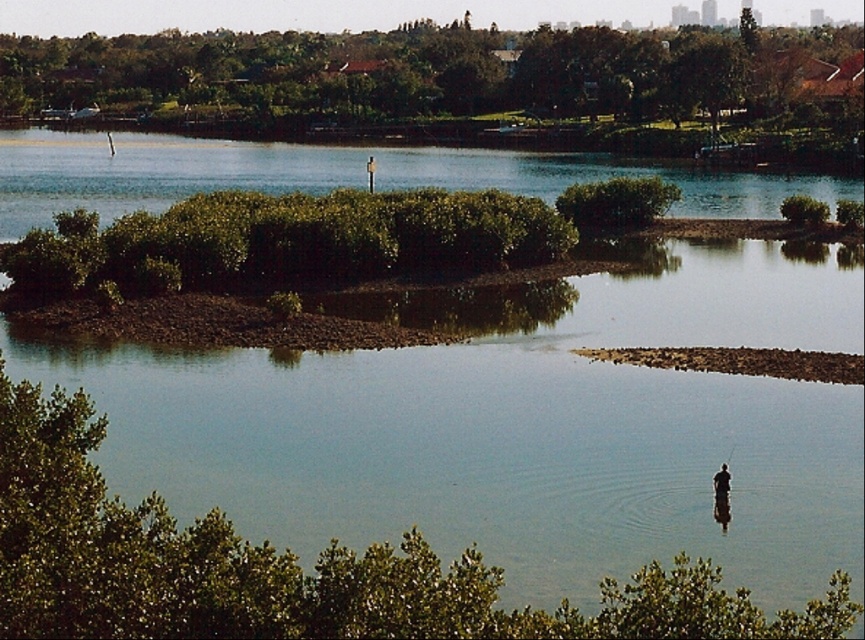
Can you confirm if green leafy tree at lower center is smaller than dark brown wooden pole at center?

Incorrect, green leafy tree at lower center is not smaller in size than dark brown wooden pole at center.

Is green leafy tree at lower center below dark brown wooden pole at center?

Actually, green leafy tree at lower center is above dark brown wooden pole at center.

Describe the element at coordinates (290, 566) in the screenshot. I see `green leafy tree at lower center` at that location.

The height and width of the screenshot is (640, 865). In order to click on green leafy tree at lower center in this screenshot , I will do `click(290, 566)`.

Which is in front, point (648, 116) or point (718, 470)?

Point (718, 470) is more forward.

Is point (286, 104) positioned in front of point (723, 484)?

No, (286, 104) is behind (723, 484).

Locate an element on the screen. green leafy tree at upper center is located at coordinates (377, 74).

Between green leafy tree at lower center and green leafy tree at upper center, which one is positioned higher?

Answer: green leafy tree at upper center is above.

What do you see at coordinates (290, 566) in the screenshot? The image size is (865, 640). I see `green leafy tree at lower center` at bounding box center [290, 566].

The width and height of the screenshot is (865, 640). In order to click on green leafy tree at lower center in this screenshot , I will do `click(290, 566)`.